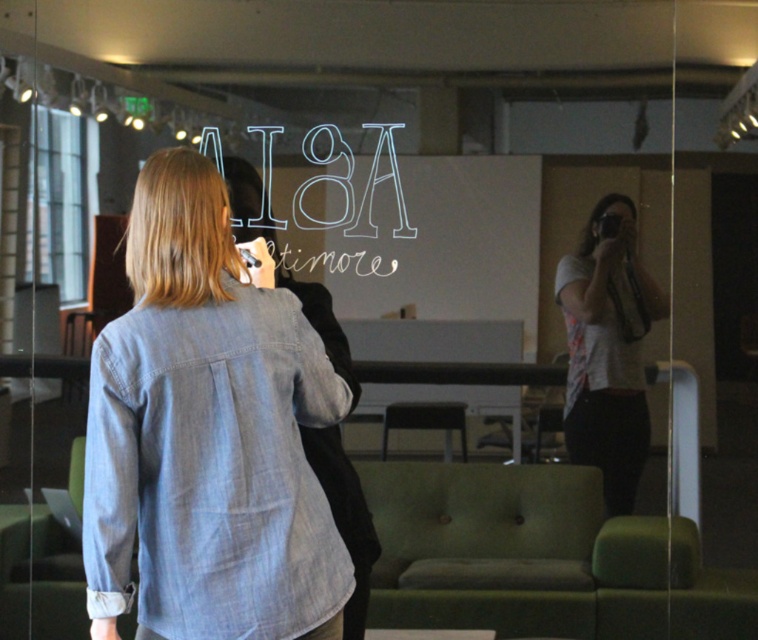
You are a photographer in the office and need to focus your camera on the white chalk writing at center. However, there is a white printed shirt at center in the way. Can you adjust your camera to focus on the chalk writing without moving the shirt?

The white printed shirt at center is closer to the viewer than the white chalk writing at center. Therefore, you can adjust the camera focus to the background to capture the white chalk writing at center while keeping the shirt out of focus.